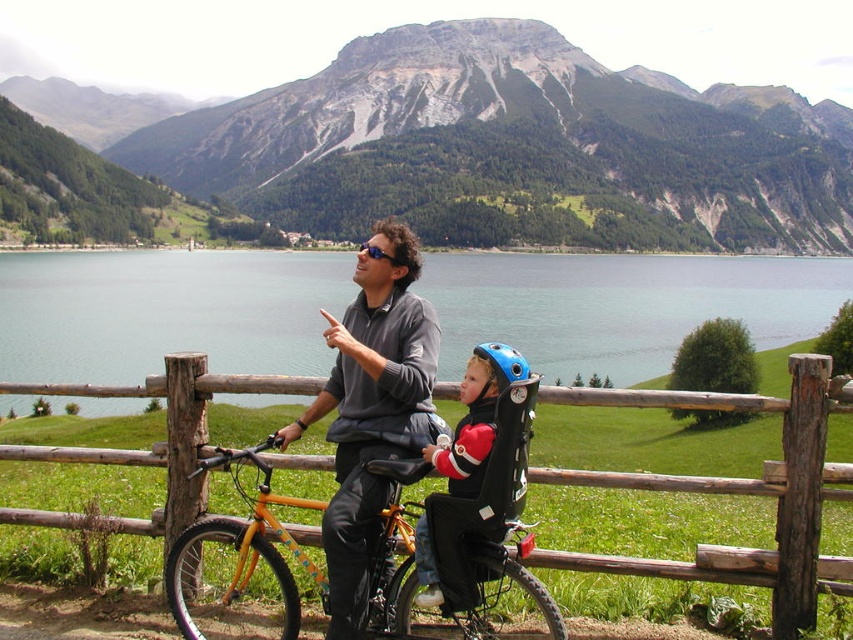
Question: Which point appears farthest from the camera in this image?

Choices:
 (A) (390, 67)
 (B) (347, 292)

Answer: (A)

Question: Is blue water at upper center positioned at the back of blue matte helmet at center?

Choices:
 (A) no
 (B) yes

Answer: (B)

Question: Does blue water at upper center appear under matte gray sweater at center?

Choices:
 (A) yes
 (B) no

Answer: (B)

Question: Among these objects, which one is farthest from the camera?

Choices:
 (A) blue water at upper center
 (B) matte gray sweater at center

Answer: (A)

Question: Which of the following is the closest to the observer?

Choices:
 (A) (433, 456)
 (B) (712, 554)

Answer: (B)

Question: Does matte black helmet at center have a lesser width compared to blue matte helmet at center?

Choices:
 (A) no
 (B) yes

Answer: (B)